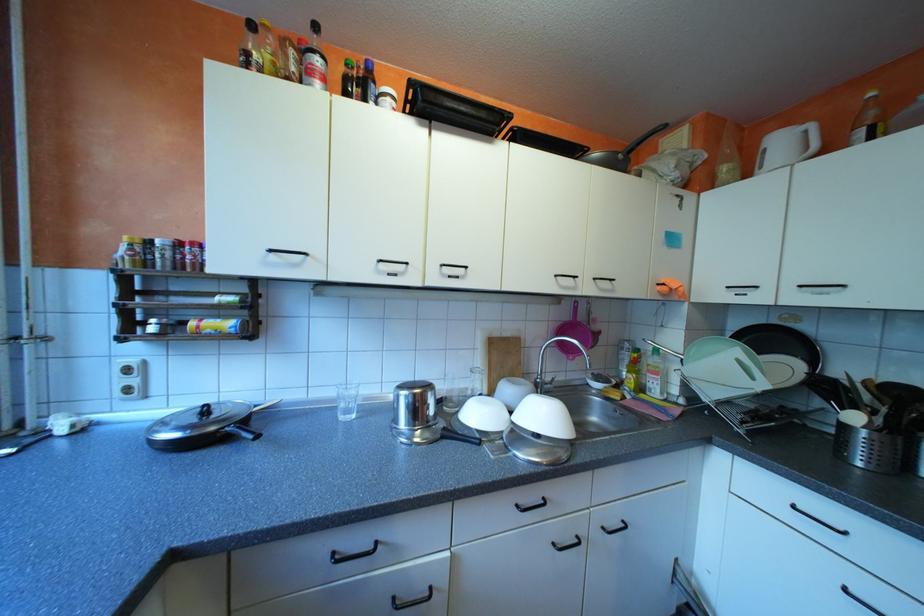
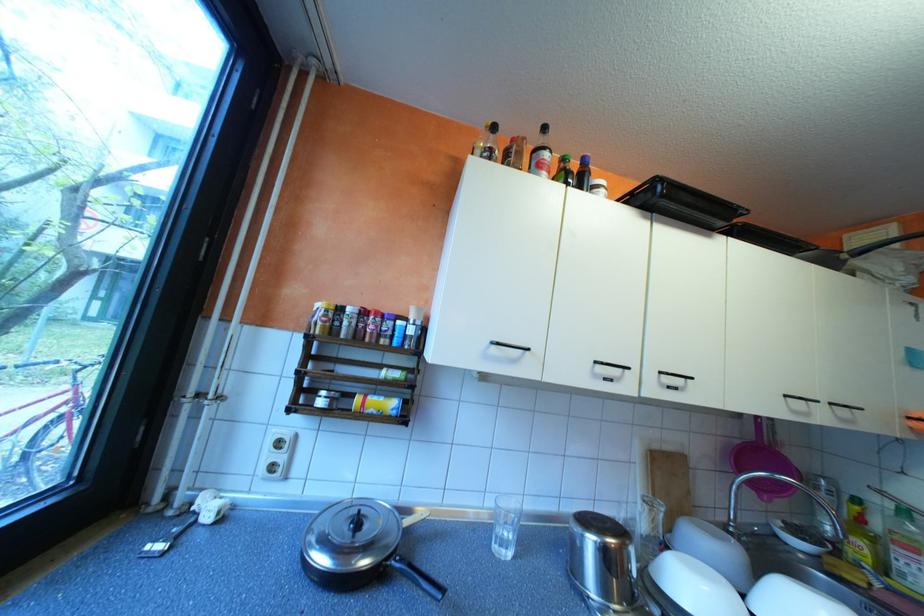
Where in the second image is the point corresponding to (567,275) from the first image?

(797, 395)